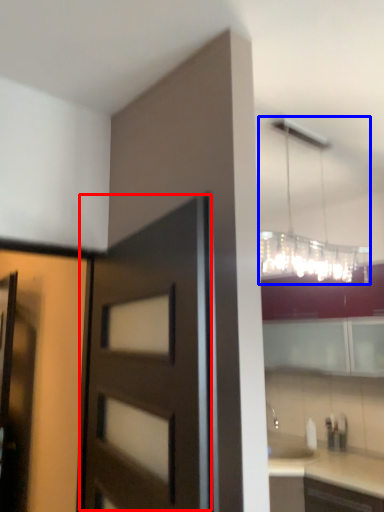
Question: Which object appears farthest to the camera in this image, door (highlighted by a red box) or lamp (highlighted by a blue box)?

Choices:
 (A) door
 (B) lamp

Answer: (B)